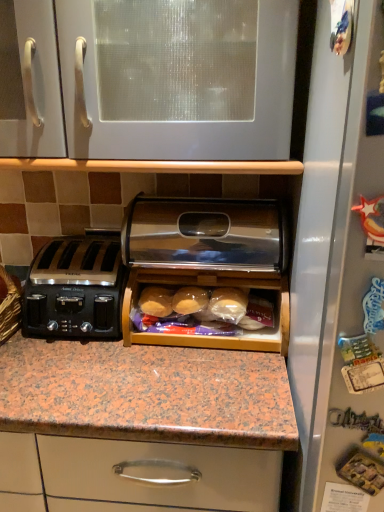
Question: From a real-world perspective, is black plastic toaster at left located beneath white glossy cabinet at upper center?

Choices:
 (A) yes
 (B) no

Answer: (A)

Question: Is black plastic toaster at left taller than white glossy cabinet at upper center?

Choices:
 (A) no
 (B) yes

Answer: (A)

Question: Does black plastic toaster at left appear on the right side of white glossy cabinet at upper center?

Choices:
 (A) yes
 (B) no

Answer: (B)

Question: Is black plastic toaster at left wider than white glossy cabinet at upper center?

Choices:
 (A) yes
 (B) no

Answer: (B)

Question: Is black plastic toaster at left closer to camera compared to white glossy cabinet at upper center?

Choices:
 (A) yes
 (B) no

Answer: (B)

Question: In the image, is wooden bread box at center positioned in front of or behind white glossy cabinet at upper center?

Choices:
 (A) front
 (B) behind

Answer: (B)

Question: From the image's perspective, is wooden bread box at center above or below white glossy cabinet at upper center?

Choices:
 (A) above
 (B) below

Answer: (B)

Question: Is wooden bread box at center situated inside white glossy cabinet at upper center or outside?

Choices:
 (A) inside
 (B) outside

Answer: (B)

Question: From a real-world perspective, is wooden bread box at center physically located above or below white glossy cabinet at upper center?

Choices:
 (A) below
 (B) above

Answer: (A)

Question: Considering the positions of white glossy cabinet at upper center and wooden bread box at center in the image, is white glossy cabinet at upper center bigger or smaller than wooden bread box at center?

Choices:
 (A) small
 (B) big

Answer: (B)

Question: From their relative heights in the image, would you say white glossy cabinet at upper center is taller or shorter than wooden bread box at center?

Choices:
 (A) tall
 (B) short

Answer: (A)

Question: In the image, is white glossy cabinet at upper center positioned in front of or behind wooden bread box at center?

Choices:
 (A) front
 (B) behind

Answer: (A)

Question: Based on their positions, is white glossy cabinet at upper center located to the left or right of wooden bread box at center?

Choices:
 (A) right
 (B) left

Answer: (B)

Question: Considering the positions of white glossy cabinet at upper center and black plastic toaster at left in the image, is white glossy cabinet at upper center taller or shorter than black plastic toaster at left?

Choices:
 (A) tall
 (B) short

Answer: (A)

Question: From the image's perspective, relative to black plastic toaster at left, is white glossy cabinet at upper center above or below?

Choices:
 (A) above
 (B) below

Answer: (A)